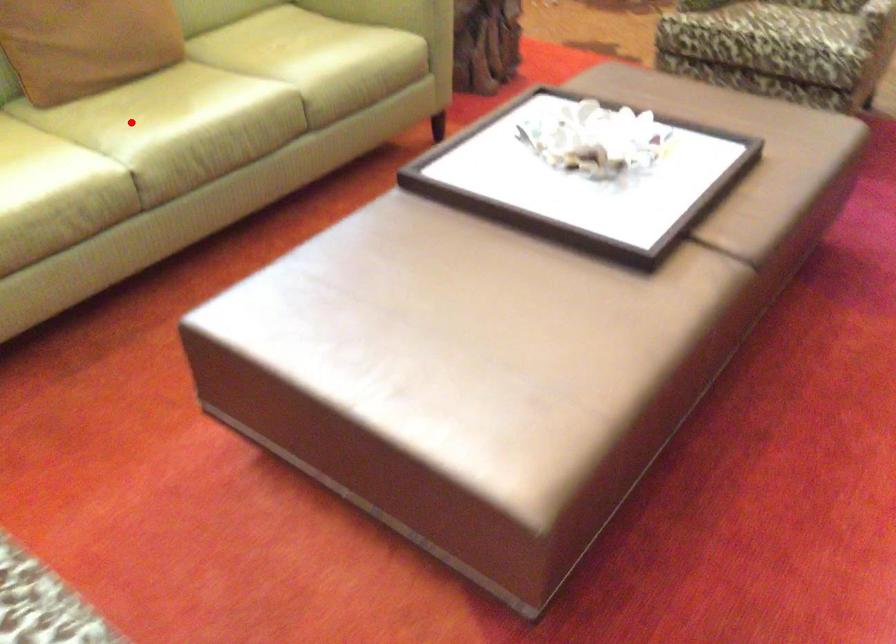
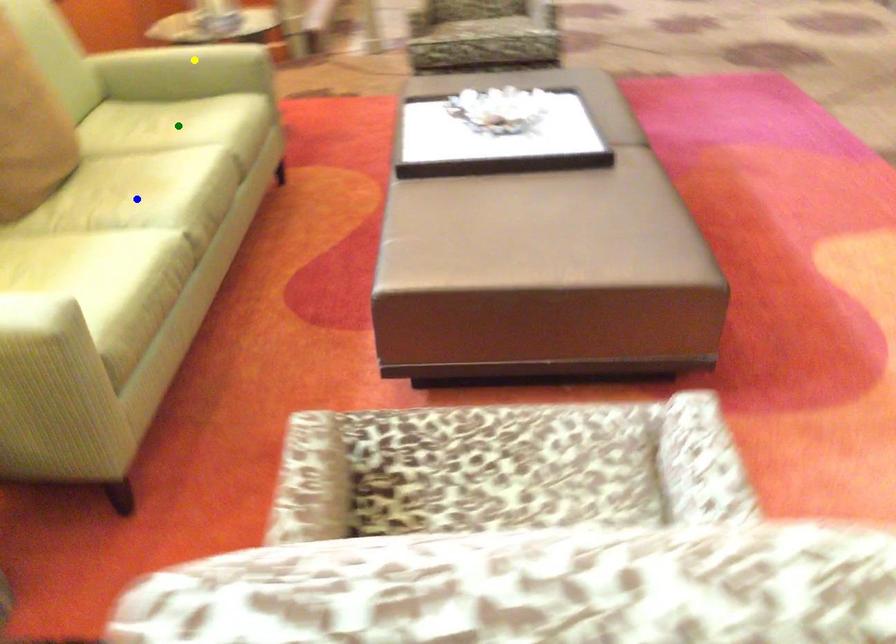
Question: I am providing you with two images of the same scene from different viewpoints. A red point is marked on the first image. You are given multiple points on the second image. Can you choose the point in image 2 that corresponds to the point in image 1?

Choices:
 (A) blue point
 (B) yellow point
 (C) green point

Answer: (A)